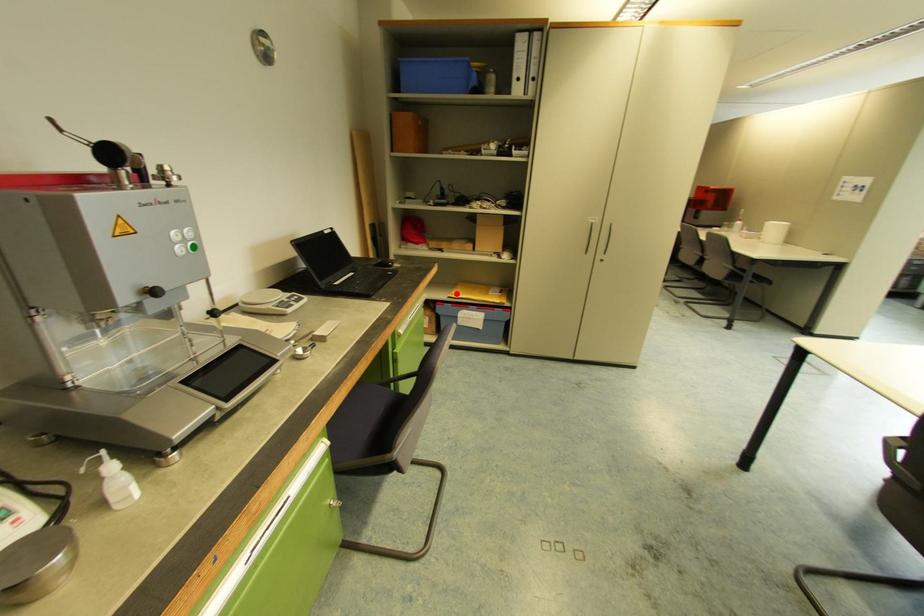
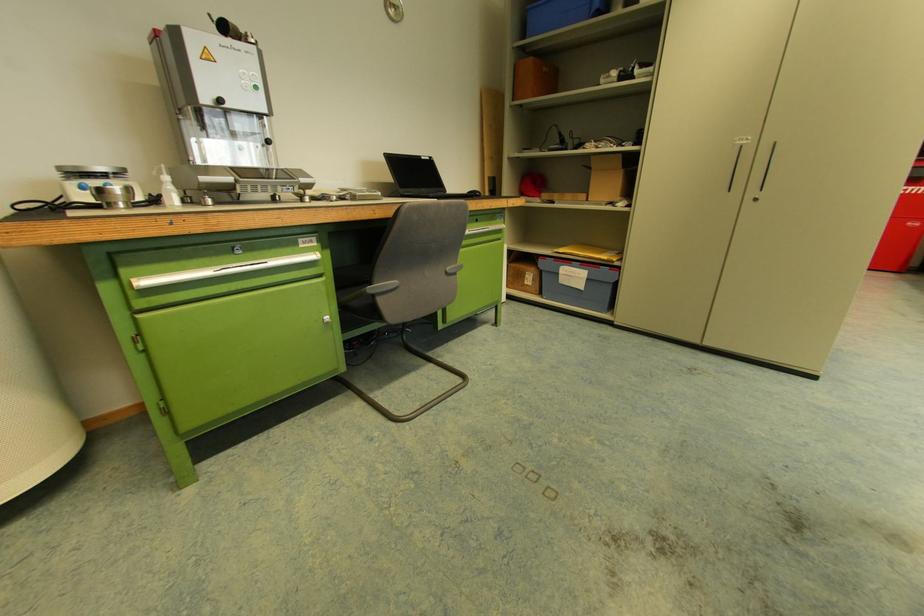
The point at the highlighted location is marked in the first image. Where is the corresponding point in the second image?

(563, 249)